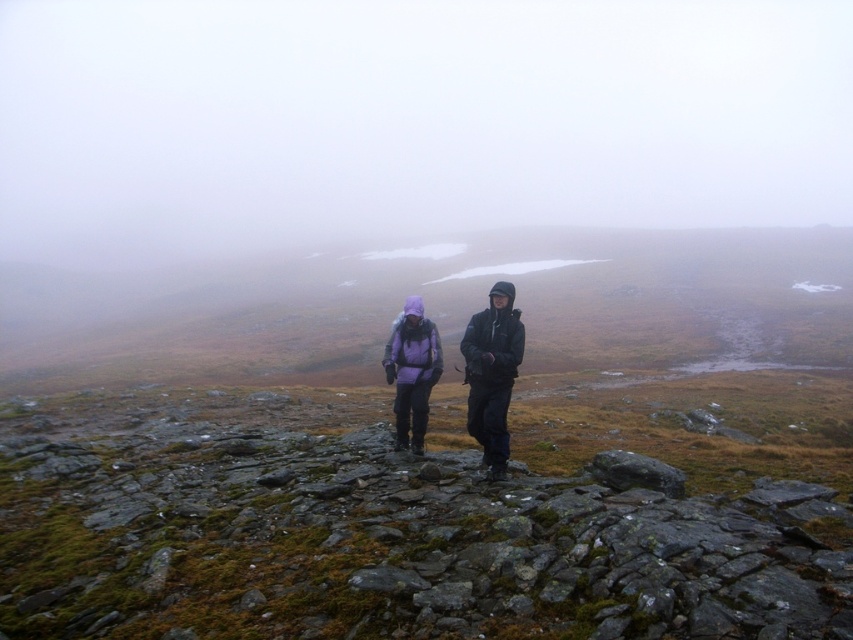
Question: Considering the relative positions of matte purple jacket at center and purple fleece jacket at center in the image provided, where is matte purple jacket at center located with respect to purple fleece jacket at center?

Choices:
 (A) right
 (B) left

Answer: (A)

Question: Which object is positioned farthest from the purple fleece jacket at center?

Choices:
 (A) dark gray jacket at center
 (B) matte purple jacket at center

Answer: (A)

Question: Does matte purple jacket at center have a larger size compared to purple fleece jacket at center?

Choices:
 (A) yes
 (B) no

Answer: (A)

Question: Does matte purple jacket at center appear under dark gray jacket at center?

Choices:
 (A) no
 (B) yes

Answer: (B)

Question: Which object appears closest to the camera in this image?

Choices:
 (A) purple fleece jacket at center
 (B) dark gray jacket at center

Answer: (B)

Question: Among these points, which one is nearest to the camera?

Choices:
 (A) click(502, 358)
 (B) click(399, 358)
 (C) click(520, 324)

Answer: (A)